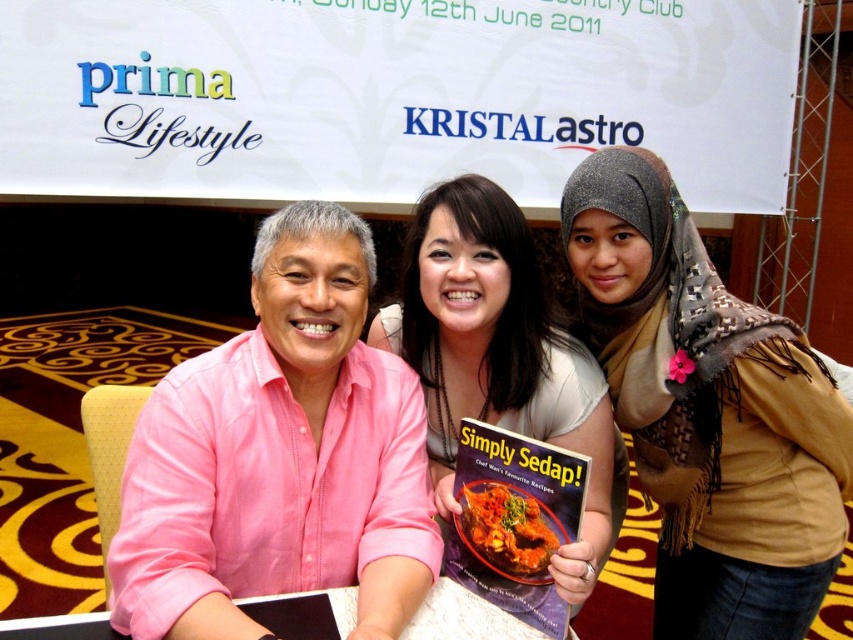
Is white paper at center smaller than tomato sauce dish at center?

Incorrect, white paper at center is not smaller in size than tomato sauce dish at center.

Which is more to the right, white paper at center or tomato sauce dish at center?

tomato sauce dish at center

The height and width of the screenshot is (640, 853). Find the location of `white paper at center`. white paper at center is located at coordinates (463, 618).

I want to click on white paper at center, so click(463, 618).

Is pink linen shirt at left smaller than white paper at center?

No, pink linen shirt at left is not smaller than white paper at center.

Does pink linen shirt at left appear on the right side of white paper at center?

No, pink linen shirt at left is not to the right of white paper at center.

Locate an element on the screen. The width and height of the screenshot is (853, 640). pink linen shirt at left is located at coordinates (280, 456).

Between matte white shirt at center and white paper at center, which one appears on the right side from the viewer's perspective?

matte white shirt at center

Can you confirm if matte white shirt at center is positioned to the left of white paper at center?

In fact, matte white shirt at center is to the right of white paper at center.

Which is in front, point (573, 362) or point (479, 595)?

Point (479, 595) is in front.

Identify the location of matte white shirt at center. (498, 356).